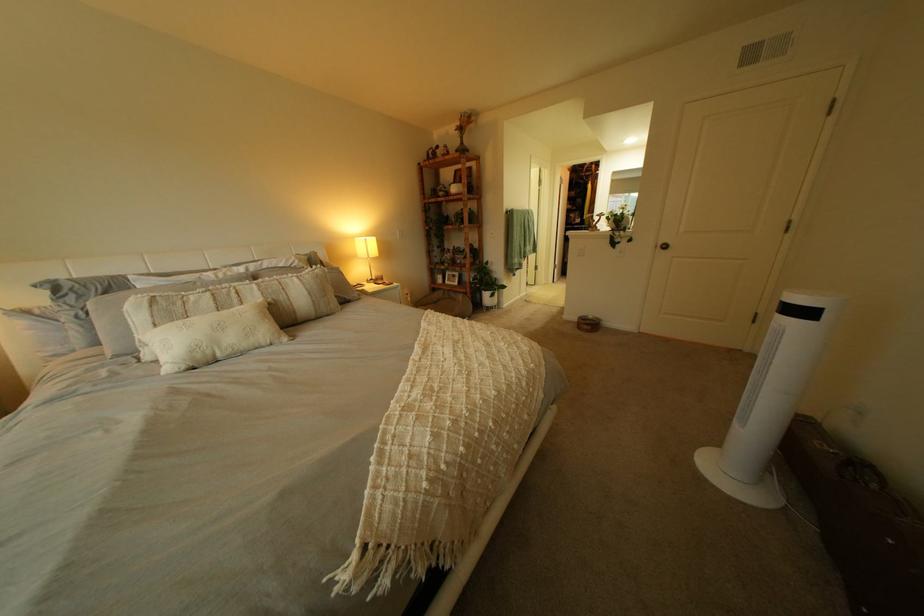
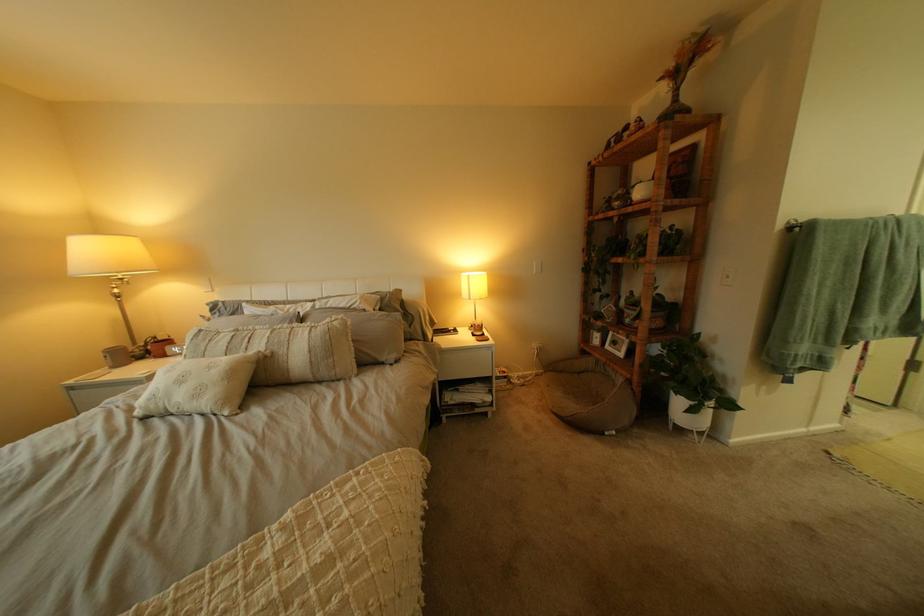
Find the pixel in the second image that matches point (463, 284) in the first image.

(623, 347)